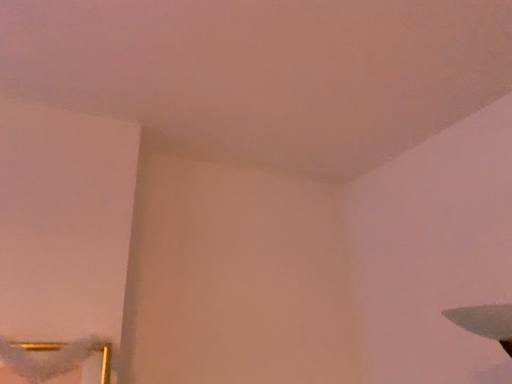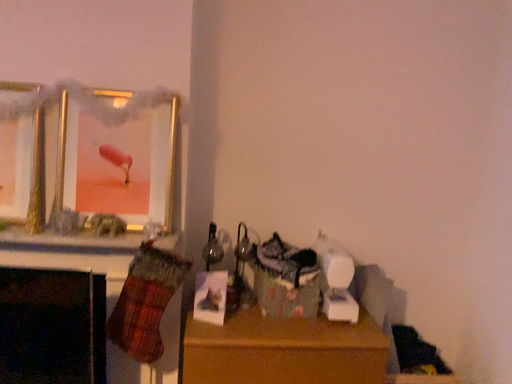
Question: Which way did the camera rotate in the video?

Choices:
 (A) rotated left
 (B) rotated right

Answer: (A)